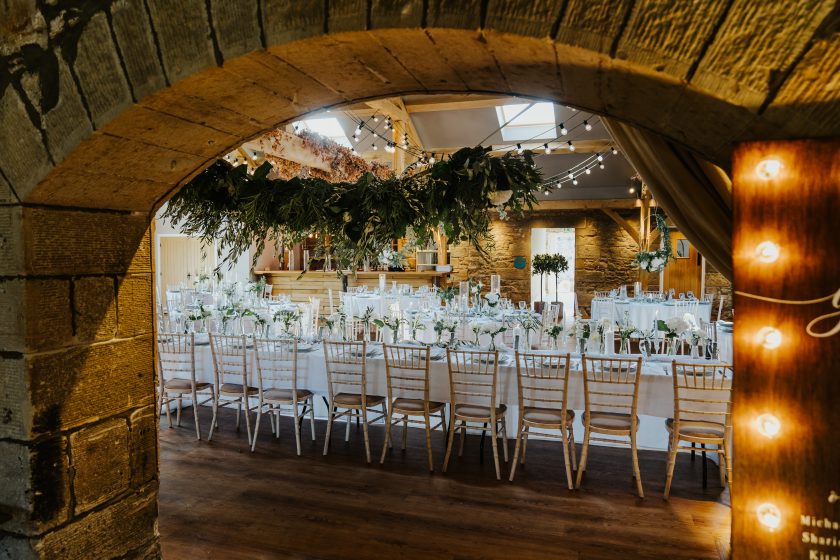
Where is `archway`? This screenshot has width=840, height=560. archway is located at coordinates (186, 48).